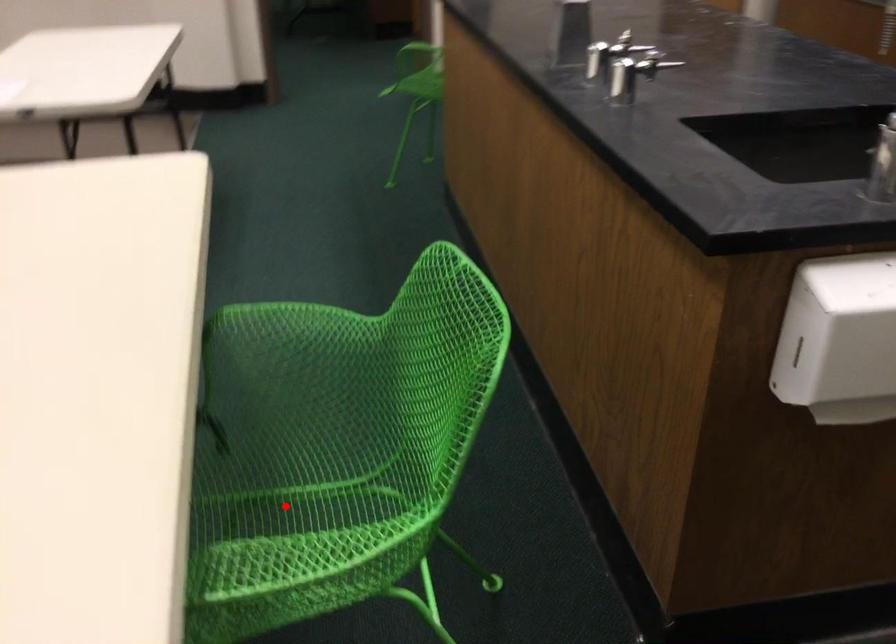
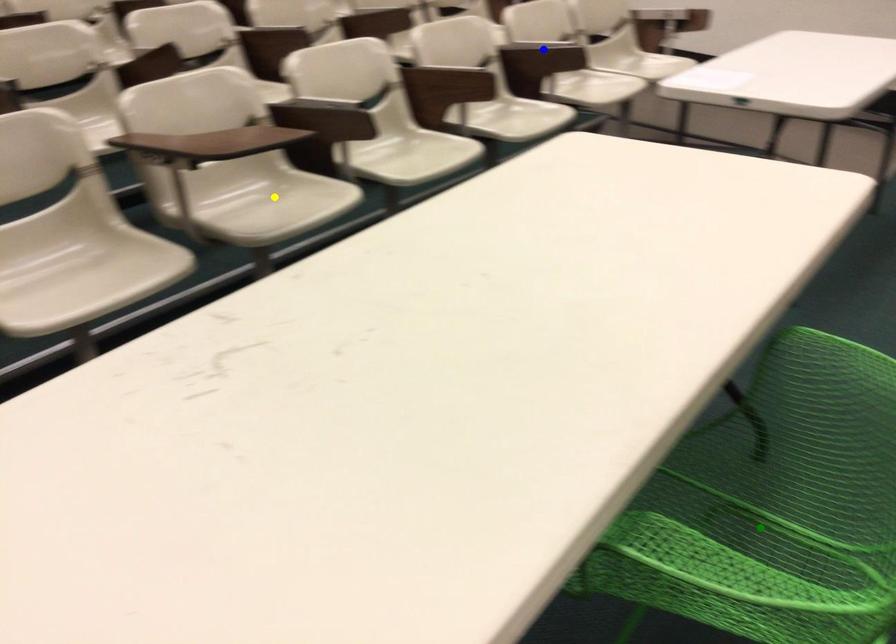
Question: I am providing you with two images of the same scene from different viewpoints. A red point is marked on the first image. You are given multiple points on the second image. In image 2, which mark is for the same physical point as the one in image 1?

Choices:
 (A) green point
 (B) blue point
 (C) yellow point

Answer: (A)